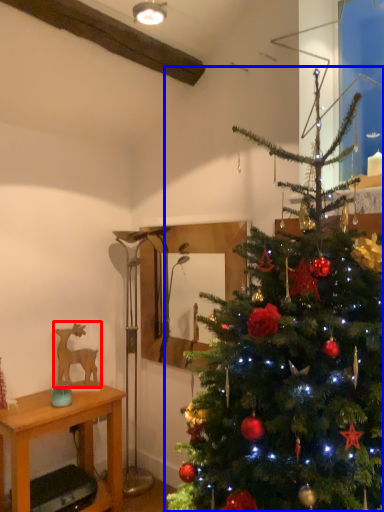
Question: Which object appears closest to the camera in this image, animal (highlighted by a red box) or christmas tree (highlighted by a blue box)?

Choices:
 (A) animal
 (B) christmas tree

Answer: (B)